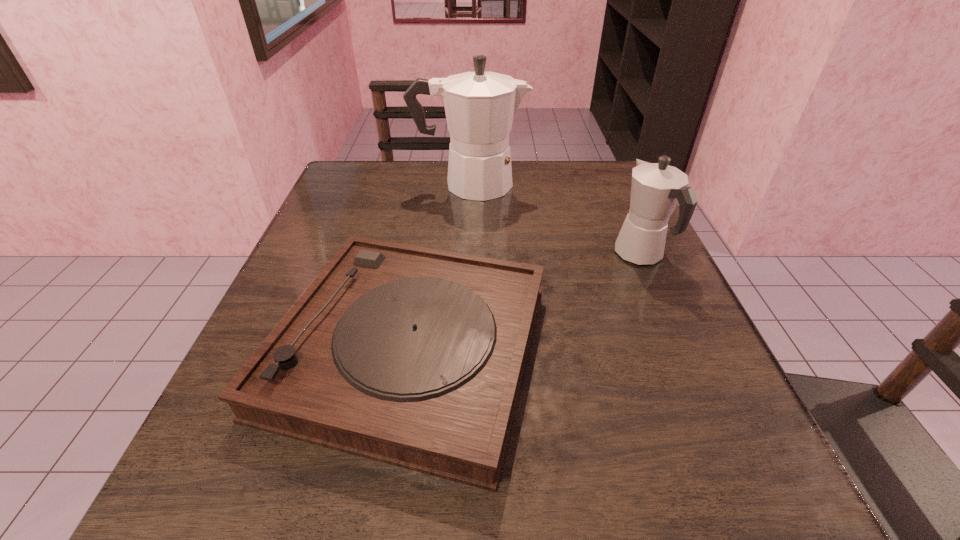
This screenshot has width=960, height=540. Identify the location of the farthest object. pyautogui.click(x=480, y=106).

The image size is (960, 540). I want to click on the tallest object, so click(x=480, y=106).

This screenshot has height=540, width=960. I want to click on the right coffeepot, so click(656, 189).

This screenshot has height=540, width=960. I want to click on the shorter coffeepot, so click(x=656, y=189).

Locate an element on the screen. phonograph record is located at coordinates (411, 356).

Locate an element on the screen. The width and height of the screenshot is (960, 540). free region located at the spout of the left coffeepot is located at coordinates (620, 184).

This screenshot has width=960, height=540. I want to click on vacant space situated 0.230m on the back of the nearer coffeepot, so click(606, 179).

I want to click on blank space located on the right of the shortest object, so click(582, 349).

What are the coordinates of `object situated at the far edge` in the screenshot? It's located at (480, 106).

Where is `object at the near edge`? The height and width of the screenshot is (540, 960). object at the near edge is located at coordinates (411, 356).